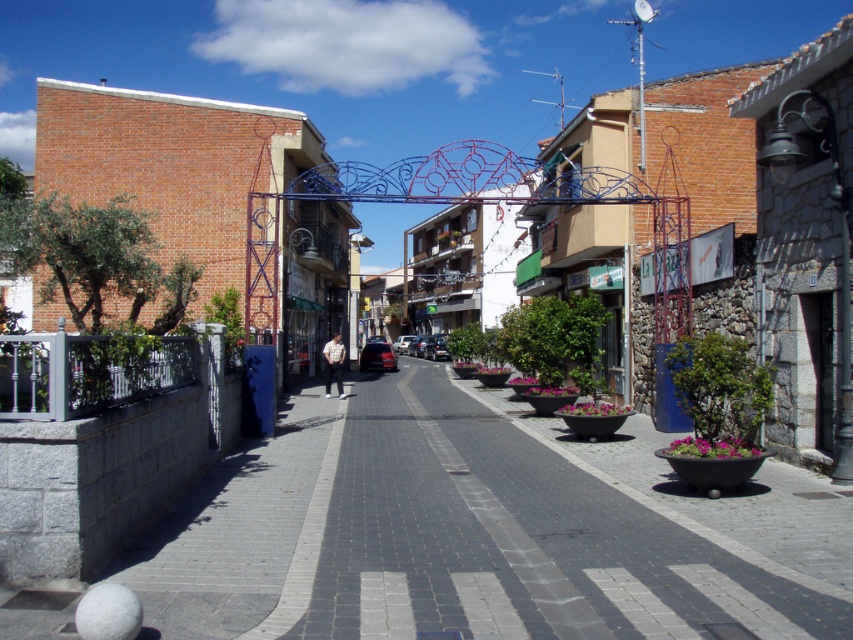
Is gray concrete pavement at center to the right of white cotton shirt at center from the viewer's perspective?

Indeed, gray concrete pavement at center is positioned on the right side of white cotton shirt at center.

Based on the photo, can you confirm if gray concrete pavement at center is thinner than white cotton shirt at center?

No.

The image size is (853, 640). Find the location of `gray concrete pavement at center`. gray concrete pavement at center is located at coordinates (480, 532).